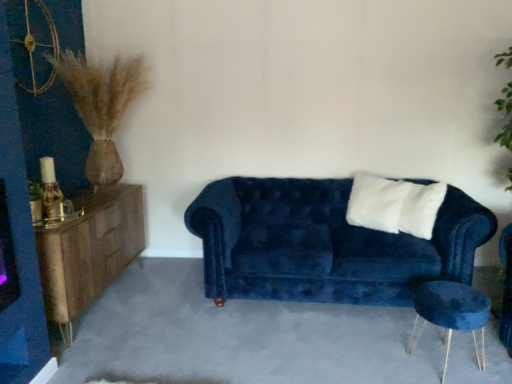
Question: In terms of height, does velvet blue side table at lower right look taller or shorter compared to velvet blue couch at center?

Choices:
 (A) short
 (B) tall

Answer: (A)

Question: Considering the positions of velvet blue side table at lower right and velvet blue couch at center in the image, is velvet blue side table at lower right bigger or smaller than velvet blue couch at center?

Choices:
 (A) small
 (B) big

Answer: (A)

Question: Estimate the real-world distances between objects in this image. Which object is farther from the woodenmaterial/texturedresser at left?

Choices:
 (A) velvet blue side table at lower right
 (B) white soft pillow at center
 (C) velvet blue couch at center

Answer: (B)

Question: Estimate the real-world distances between objects in this image. Which object is closer to the velvet blue side table at lower right?

Choices:
 (A) woodenmaterial/texturedresser at left
 (B) white soft pillow at center
 (C) velvet blue couch at center

Answer: (C)